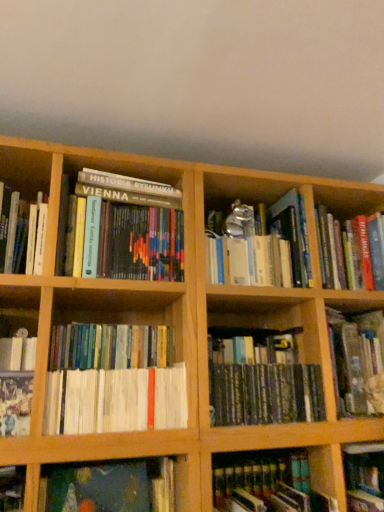
Question: Relative to white paper book at lower left, arranged as the 2th book when viewed from the left, is hardcover book at lower left, which is counted as the 1th book, starting from the left, in front or behind?

Choices:
 (A) behind
 (B) front

Answer: (B)

Question: From the image's perspective, is hardcover book at lower left, positioned as the 9th book in right-to-left order, located above or below white paper book at lower left, arranged as the 2th book when viewed from the left?

Choices:
 (A) below
 (B) above

Answer: (A)

Question: Which object is positioned closest to the hardcover book at lower left, positioned as the 9th book in right-to-left order?

Choices:
 (A) hardcover book at center, the 6th book in the left-to-right sequence
 (B) white paper book at lower left, placed as the eighth book when sorted from right to left
 (C) wooden bookshelf at upper right
 (D) hardcover book at lower right, which is the 2th book from right to left
 (E) white paperbacks at center, arranged as the 4th book when viewed from the left

Answer: (B)

Question: Estimate the real-world distances between objects in this image. Which object is farther from the hardcover book at center, the 6th book in the left-to-right sequence?

Choices:
 (A) hardcover book at center right, which is the first book from right to left
 (B) hardcover book at lower right, which is the 2th book from right to left
 (C) hardcover book at lower left, positioned as the 9th book in right-to-left order
 (D) hardcover book at center, which is the 7th book from right to left
 (E) white paperbacks at center, arranged as the 4th book when viewed from the left

Answer: (C)